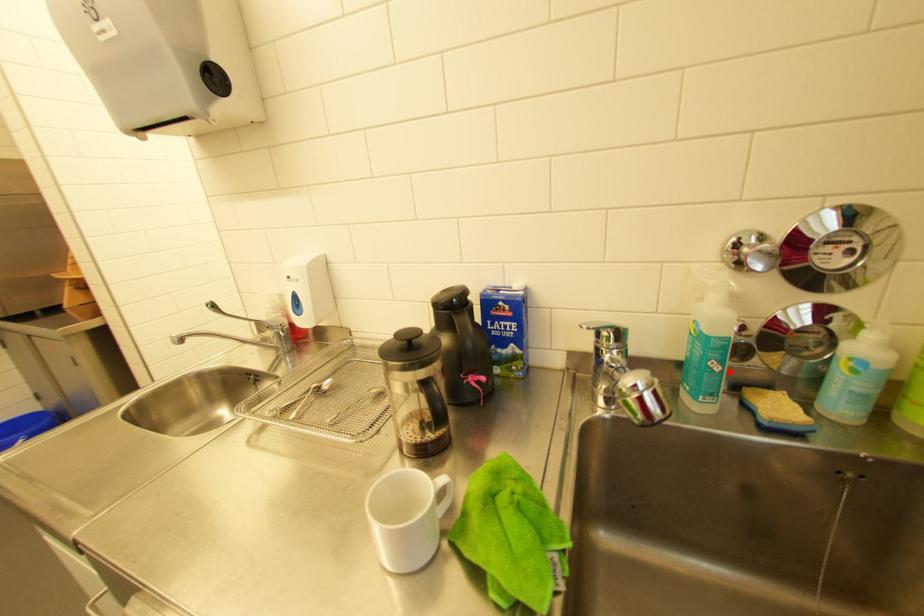
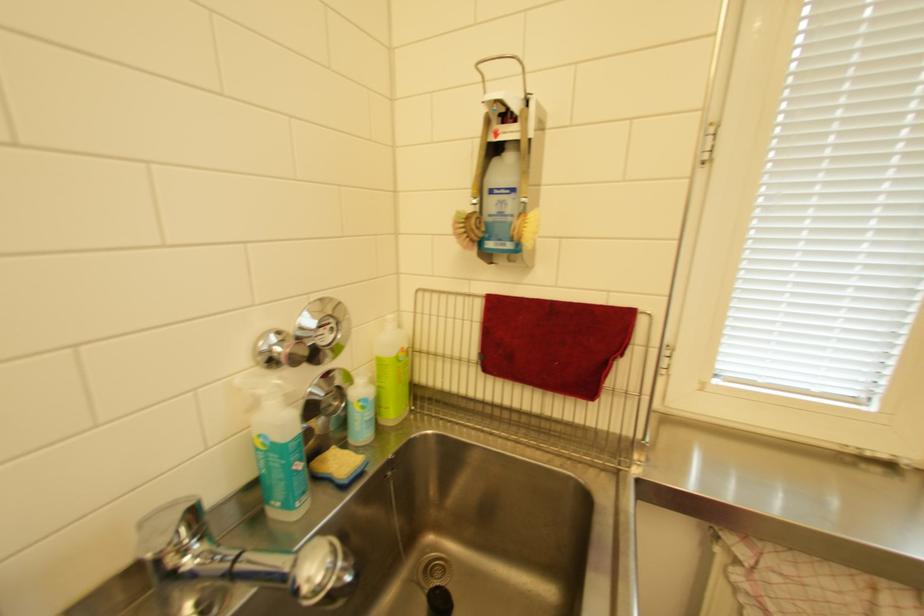
Locate, in the second image, the point that corresponds to the highlighted location in the first image.

(312, 467)